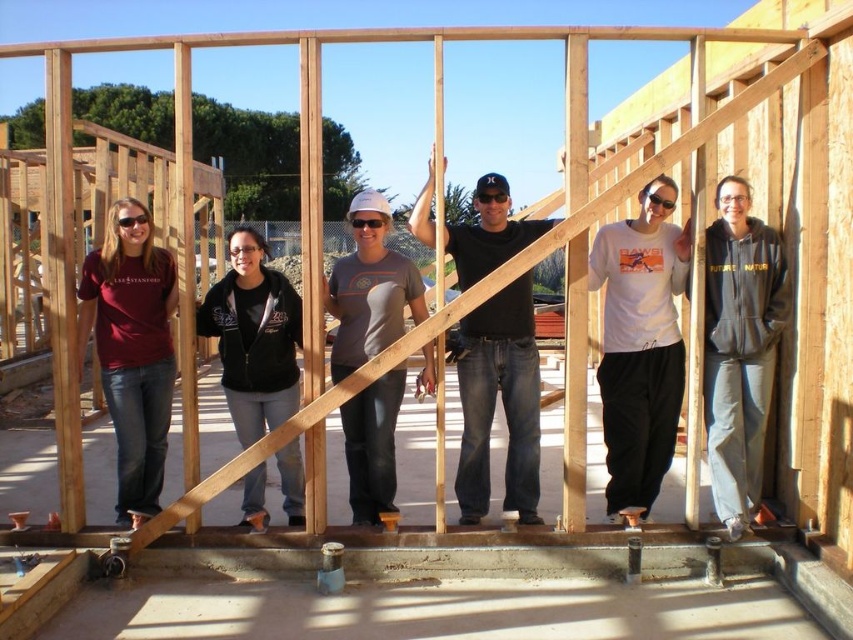
Does point (607, 392) lie behind point (375, 291)?

Yes, point (607, 392) is behind point (375, 291).

The image size is (853, 640). Describe the element at coordinates (640, 344) in the screenshot. I see `white matte t-shirt at center` at that location.

Does point (602, 387) lie in front of point (372, 492)?

That is False.

You are a GUI agent. You are given a task and a screenshot of the screen. Output one action in this format:
    pyautogui.click(x=<x>, y=<y>)
    Task: Click on the white matte t-shirt at center
    The width and height of the screenshot is (853, 640).
    Given the screenshot: What is the action you would take?
    pyautogui.click(x=640, y=344)

Based on the photo, can you confirm if black matte shirt at center is positioned to the right of gray matte t-shirt at center?

Yes, black matte shirt at center is to the right of gray matte t-shirt at center.

Does black matte shirt at center have a lesser width compared to gray matte t-shirt at center?

No.

Where is `black matte shirt at center`? black matte shirt at center is located at coordinates (502, 401).

Who is taller, white matte t-shirt at center or gray fleece hoodie at center?

With more height is white matte t-shirt at center.

Which is in front, point (630, 365) or point (769, 340)?

Point (769, 340)

Locate an element on the screen. Image resolution: width=853 pixels, height=640 pixels. white matte t-shirt at center is located at coordinates (640, 344).

Locate an element on the screen. This screenshot has height=640, width=853. white matte t-shirt at center is located at coordinates (640, 344).